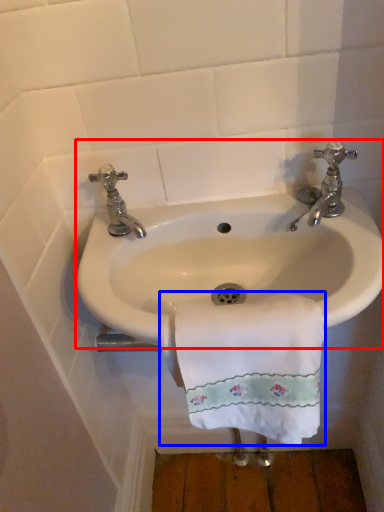
Question: Among these objects, which one is nearest to the camera, sink (highlighted by a red box) or towel/napkin (highlighted by a blue box)?

Choices:
 (A) sink
 (B) towel/napkin

Answer: (B)